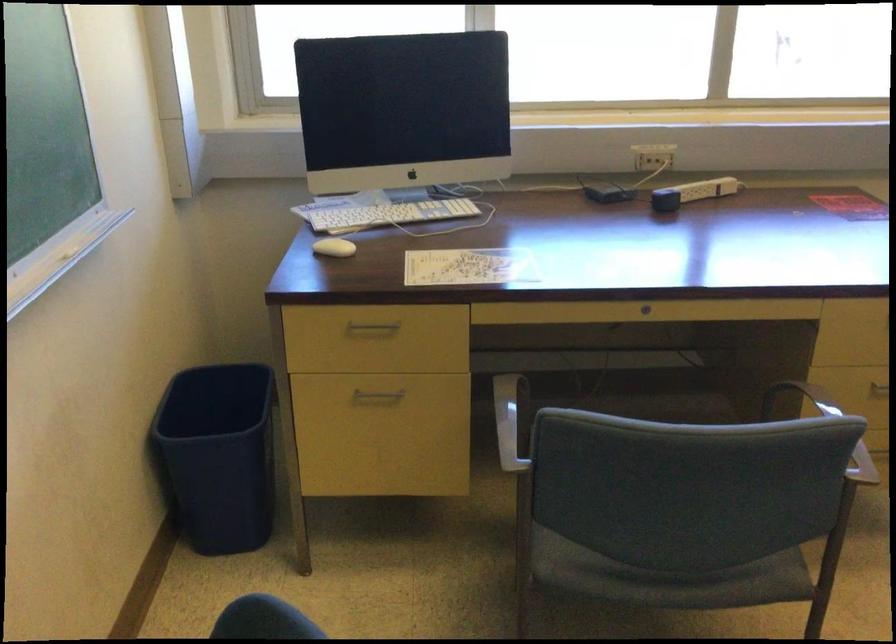
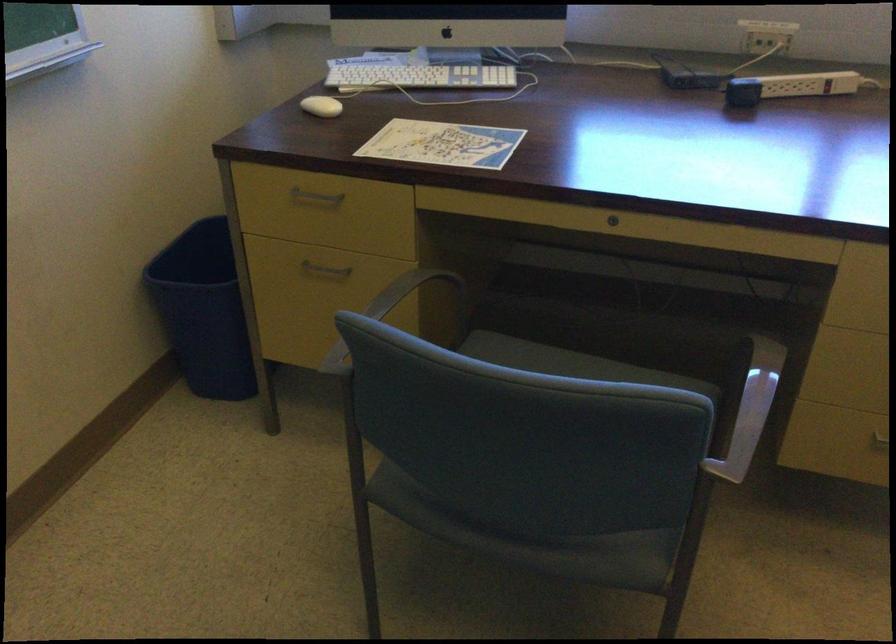
The point at (445, 418) is marked in the first image. Where is the corresponding point in the second image?

(393, 308)